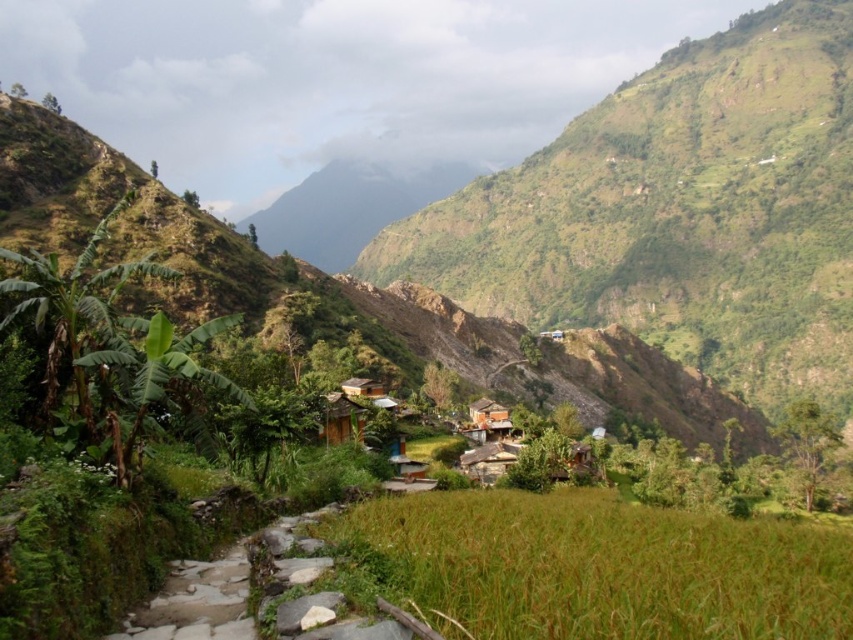
Who is positioned more to the right, gray stone path at lower left or brown wooden hut at center?

brown wooden hut at center

Is gray stone path at lower left further to camera compared to brown wooden hut at center?

That is False.

Between point (277, 528) and point (480, 412), which one is positioned in front?

Point (277, 528)

In order to click on gray stone path at lower left in this screenshot , I will do `click(196, 602)`.

Can you confirm if brown grassy rice field at lower center is bigger than gray stone path at lower left?

Indeed, brown grassy rice field at lower center has a larger size compared to gray stone path at lower left.

From the picture: Does brown grassy rice field at lower center have a greater height compared to gray stone path at lower left?

Yes.

Between point (592, 625) and point (184, 584), which one is positioned behind?

Positioned behind is point (184, 584).

Where is `brown grassy rice field at lower center`? Image resolution: width=853 pixels, height=640 pixels. brown grassy rice field at lower center is located at coordinates (604, 566).

Does green grassy hill at center have a greater width compared to brown grassy rice field at lower center?

Yes.

The image size is (853, 640). In order to click on green grassy hill at center in this screenshot , I will do `click(679, 212)`.